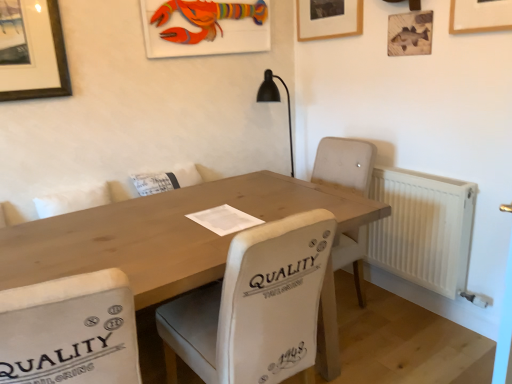
Question: Does white fabric chair at center, which is the second chair in left-to-right order, have a lesser height compared to natural wood table at center?

Choices:
 (A) no
 (B) yes

Answer: (A)

Question: From a real-world perspective, is white fabric chair at center, which is the second chair in left-to-right order, located higher than natural wood table at center?

Choices:
 (A) no
 (B) yes

Answer: (B)

Question: From the image's perspective, is white fabric chair at center, which is the first chair in right-to-left order, beneath natural wood table at center?

Choices:
 (A) no
 (B) yes

Answer: (A)

Question: From the image's perspective, is white fabric chair at center, which is the first chair in right-to-left order, over natural wood table at center?

Choices:
 (A) yes
 (B) no

Answer: (A)

Question: Does white fabric chair at center, which is the first chair in right-to-left order, have a greater width compared to natural wood table at center?

Choices:
 (A) yes
 (B) no

Answer: (B)

Question: Is white fabric chair at center, which is the first chair in right-to-left order, to the right of natural wood table at center from the viewer's perspective?

Choices:
 (A) no
 (B) yes

Answer: (B)

Question: Is wooden lobster at upper center, which ranks as the 3th picture frame in right-to-left order, behind natural wood table at center?

Choices:
 (A) no
 (B) yes

Answer: (B)

Question: Considering the relative sizes of wooden lobster at upper center, which ranks as the 3th picture frame in right-to-left order, and natural wood table at center in the image provided, is wooden lobster at upper center, which ranks as the 3th picture frame in right-to-left order, taller than natural wood table at center?

Choices:
 (A) no
 (B) yes

Answer: (A)

Question: Does wooden lobster at upper center, which ranks as the 3th picture frame in right-to-left order, lie in front of natural wood table at center?

Choices:
 (A) yes
 (B) no

Answer: (B)

Question: From a real-world perspective, is wooden lobster at upper center, which ranks as the 3th picture frame in right-to-left order, located beneath natural wood table at center?

Choices:
 (A) yes
 (B) no

Answer: (B)

Question: Is wooden lobster at upper center, which ranks as the 3th picture frame in right-to-left order, smaller than natural wood table at center?

Choices:
 (A) no
 (B) yes

Answer: (B)

Question: Is wooden lobster at upper center, which ranks as the 3th picture frame in right-to-left order, to the right of natural wood table at center from the viewer's perspective?

Choices:
 (A) no
 (B) yes

Answer: (B)

Question: Does white fabric chair at center, which is the first chair in right-to-left order, appear on the left side of wooden fish at upper right, which is the 3th picture frame in left-to-right order?

Choices:
 (A) yes
 (B) no

Answer: (A)